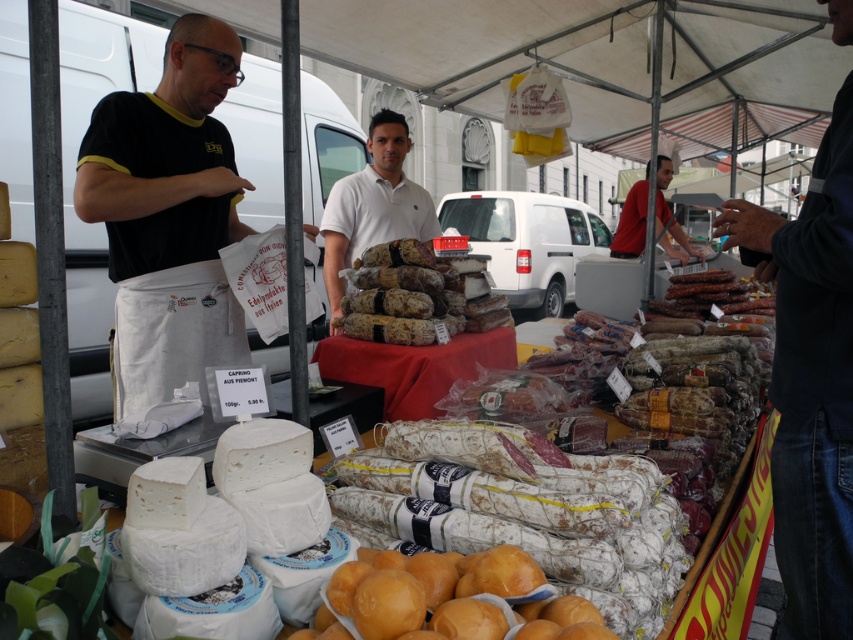
You are a customer at the market and see both the dark blue shirt at center and the white cotton shirt at center. Which shirt is taller?

The dark blue shirt at center is taller than the white cotton shirt at center.

You are standing at the market and want to take a photo of both the cheese and the cured meats. The cheese is located at point (x=596, y=614) and the cured meats are at point (x=428, y=376). Since you want both to be in focus, which item should you position closer to the camera to ensure they are both in the same focal plane?

To ensure both the cheese at point (x=596, y=614) and the cured meats at point (x=428, y=376) are in focus, you should position the cheese at point (x=596, y=614) closer to the camera. This is because point (x=596, y=614) is already closer to the camera than point (x=428, y=376), so keeping them at their current positions would mean the cheese is nearer and the cured meats are farther back. However, if adjusting their positions, moving the cheese closer would help maintain both within the depth of field.

You are a customer at the market and see two shirts displayed on a rack in the foreground. The dark blue shirt at center and the white cotton shirt at center are both available. If you want to pick the one on the right, which shirt should you choose?

The dark blue shirt at center is to the right of the white cotton shirt at center, so you should choose the dark blue shirt at center.